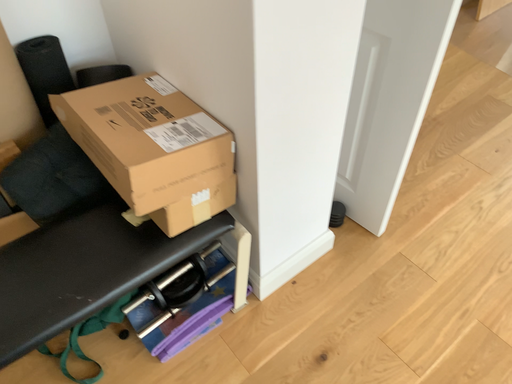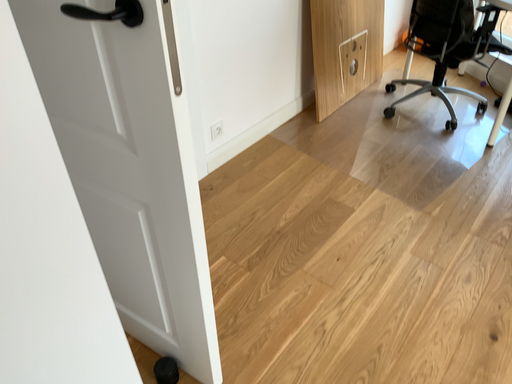
Question: How did the camera likely rotate when shooting the video?

Choices:
 (A) rotated downward
 (B) rotated upward

Answer: (B)